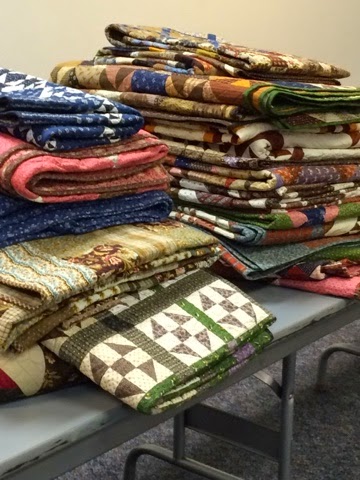
Locate an element on the screen. Image resolution: width=360 pixels, height=480 pixels. red blanket underneath blue and white blanket is located at coordinates (46, 171).